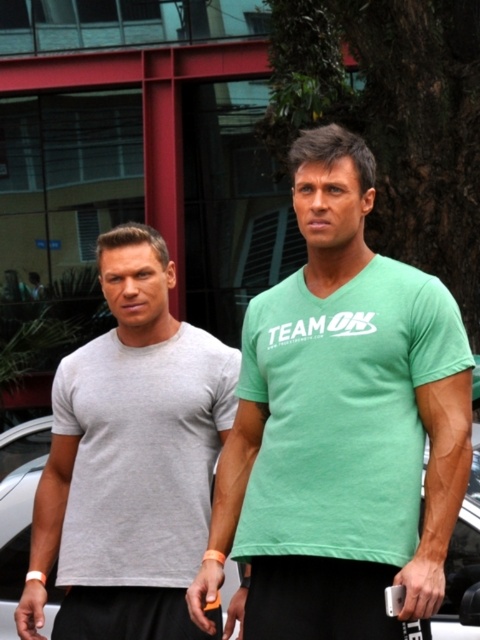
In the scene shown: Can you confirm if green matte t-shirt at center is thinner than matte gray t-shirt at left?

In fact, green matte t-shirt at center might be wider than matte gray t-shirt at left.

Consider the image. Does green matte t-shirt at center have a greater height compared to matte gray t-shirt at left?

Correct, green matte t-shirt at center is much taller as matte gray t-shirt at left.

Find the location of `green matte t-shirt at center`. green matte t-shirt at center is located at coordinates (342, 426).

This screenshot has width=480, height=640. In order to click on green matte t-shirt at center in this screenshot , I will do `click(342, 426)`.

Between green matte t-shirt at center and white matte car at center, which one appears on the left side from the viewer's perspective?

From the viewer's perspective, white matte car at center appears more on the left side.

Can you confirm if green matte t-shirt at center is shorter than white matte car at center?

Incorrect, green matte t-shirt at center's height does not fall short of white matte car at center's.

Which is in front, point (408, 580) or point (472, 516)?

Point (408, 580) is more forward.

Locate an element on the screen. green matte t-shirt at center is located at coordinates (342, 426).

Can you confirm if matte gray t-shirt at left is smaller than white matte car at center?

Incorrect, matte gray t-shirt at left is not smaller in size than white matte car at center.

Between matte gray t-shirt at left and white matte car at center, which one appears on the left side from the viewer's perspective?

Positioned to the left is white matte car at center.

Between point (28, 589) and point (478, 456), which one is positioned behind?

The point (478, 456) is behind.

Identify the location of matte gray t-shirt at left. The image size is (480, 640). (130, 460).